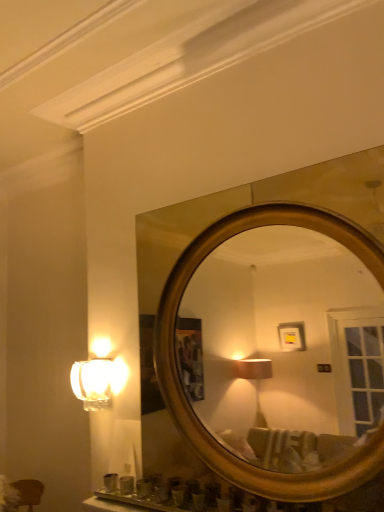
Question: Does point (254, 214) appear closer or farther from the camera than point (71, 382)?

Choices:
 (A) farther
 (B) closer

Answer: (B)

Question: In terms of height, does gold metallic mirror at upper center look taller or shorter compared to matte glass lamp at left?

Choices:
 (A) short
 (B) tall

Answer: (B)

Question: From the image's perspective, is gold metallic mirror at upper center above or below matte glass lamp at left?

Choices:
 (A) above
 (B) below

Answer: (A)

Question: Considering the positions of matte glass lamp at left and gold metallic mirror at upper center in the image, is matte glass lamp at left taller or shorter than gold metallic mirror at upper center?

Choices:
 (A) tall
 (B) short

Answer: (B)

Question: From the image's perspective, relative to gold metallic mirror at upper center, is matte glass lamp at left above or below?

Choices:
 (A) below
 (B) above

Answer: (A)

Question: In terms of width, does matte glass lamp at left look wider or thinner when compared to gold metallic mirror at upper center?

Choices:
 (A) wide
 (B) thin

Answer: (B)

Question: Is matte glass lamp at left to the left or to the right of gold metallic mirror at upper center in the image?

Choices:
 (A) right
 (B) left

Answer: (B)